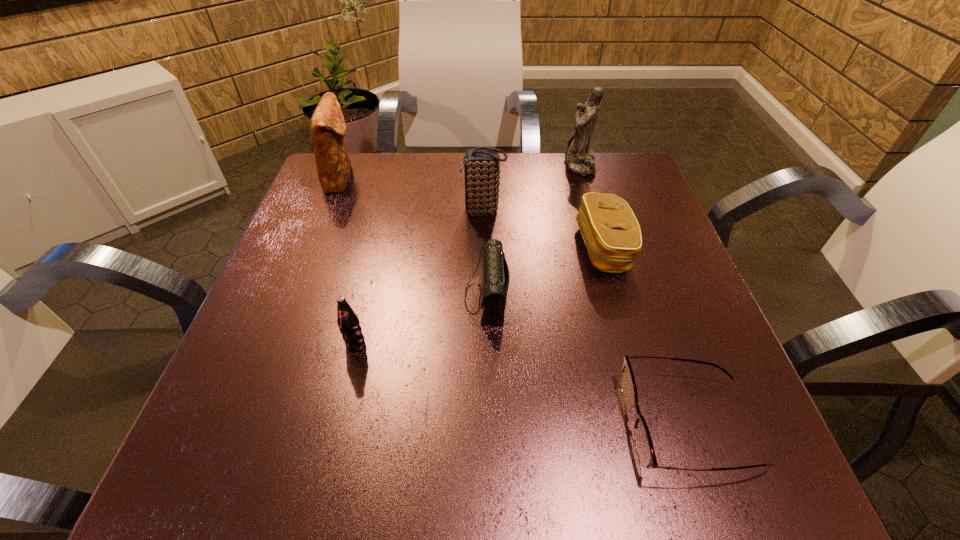
I want to click on free region located 0.290m on the front-facing side of the figurine, so click(454, 164).

Locate an element on the screen. blank space located on the front-facing side of the figurine is located at coordinates (462, 164).

Where is `vacant region located on the front-facing side of the figurine`? The height and width of the screenshot is (540, 960). vacant region located on the front-facing side of the figurine is located at coordinates (546, 164).

Image resolution: width=960 pixels, height=540 pixels. In order to click on vacant space located on the open side of the farthest clutch bag in this screenshot , I will do pyautogui.click(x=456, y=178).

I want to click on free space located with the zip open on the third nearest clutch bag, so click(371, 211).

At what (x,y) coordinates should I click in order to perform the action: click on vacant area situated 0.230m with the zip open on the third nearest clutch bag. Please return your answer as a coordinate pair (x, y). This screenshot has width=960, height=540. Looking at the image, I should click on (362, 211).

I want to click on blank space located with the zip open on the third nearest clutch bag, so click(392, 211).

Locate an element on the screen. The image size is (960, 540). vacant region located 0.210m on the front label of the second nearest object is located at coordinates (324, 480).

Find the location of a particular element. blank area located on the zipper side of the rightmost clutch bag is located at coordinates pos(398,248).

Find the location of a particular element. This screenshot has height=540, width=960. vacant area situated 0.050m on the zipper side of the rightmost clutch bag is located at coordinates (555, 248).